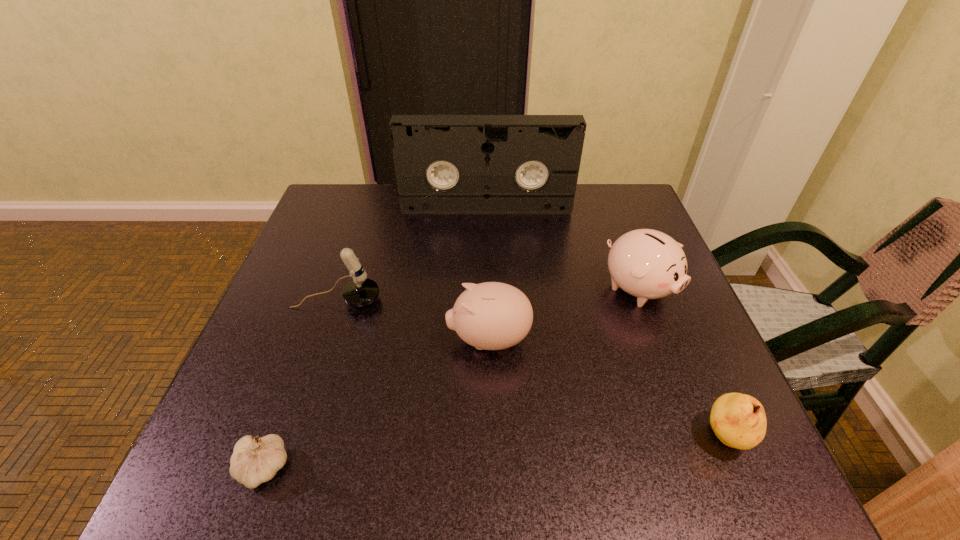
You are a GUI agent. You are given a task and a screenshot of the screen. Output one action in this format:
    pyautogui.click(x=<x>, y=<y>)
    Task: Click on the vacant space in between the left piggy bank and the pear
    This screenshot has height=540, width=960.
    Given the screenshot: What is the action you would take?
    pyautogui.click(x=608, y=388)

Where is `vacant region between the microphone and the left piggy bank`? vacant region between the microphone and the left piggy bank is located at coordinates (413, 320).

Find the location of `vacant area that lies between the garlic and the right piggy bank`. vacant area that lies between the garlic and the right piggy bank is located at coordinates (451, 379).

Find the location of `vacant region between the videotape and the pear`. vacant region between the videotape and the pear is located at coordinates (606, 322).

You are a GUI agent. You are given a task and a screenshot of the screen. Output one action in this format:
    pyautogui.click(x=<x>, y=<y>)
    Task: Click on the free area in between the pear and the right piggy bank
    
    Given the screenshot: What is the action you would take?
    pyautogui.click(x=682, y=363)

Image resolution: width=960 pixels, height=540 pixels. Find the location of `unoccupied position between the microphone and the garlic`. unoccupied position between the microphone and the garlic is located at coordinates (300, 384).

Where is `vacant area that lies between the left piggy bank and the right piggy bank`? This screenshot has width=960, height=540. vacant area that lies between the left piggy bank and the right piggy bank is located at coordinates (564, 314).

The image size is (960, 540). I want to click on vacant space that is in between the left piggy bank and the tallest object, so click(488, 274).

Identify the location of vacant space that's between the garlic and the left piggy bank. (376, 404).

Find the location of a particular element. The image size is (960, 540). free spot between the farthest object and the microphone is located at coordinates (412, 254).